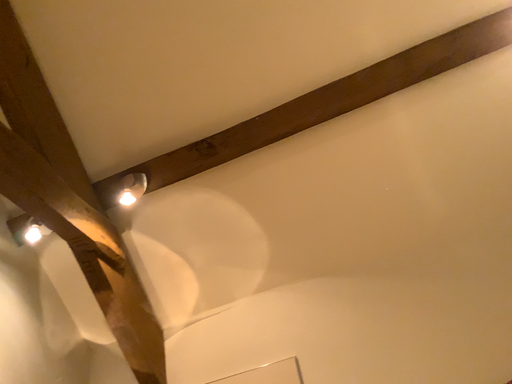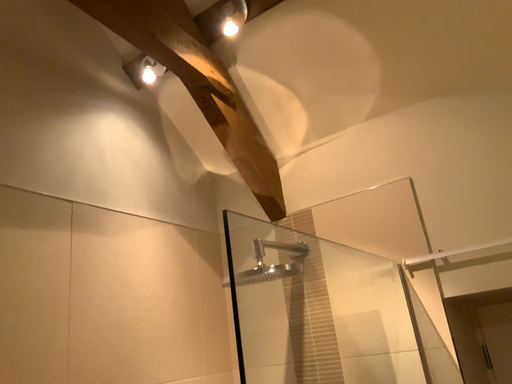
Question: How did the camera likely rotate when shooting the video?

Choices:
 (A) rotated right
 (B) rotated left

Answer: (B)